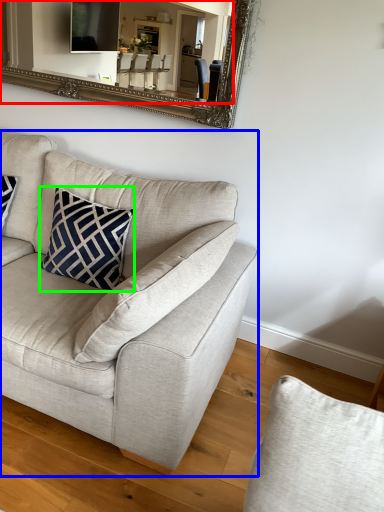
Question: Considering the real-world distances, which object is closest to mirror (highlighted by a red box)? studio couch (highlighted by a blue box) or pillow (highlighted by a green box).

Choices:
 (A) studio couch
 (B) pillow

Answer: (B)